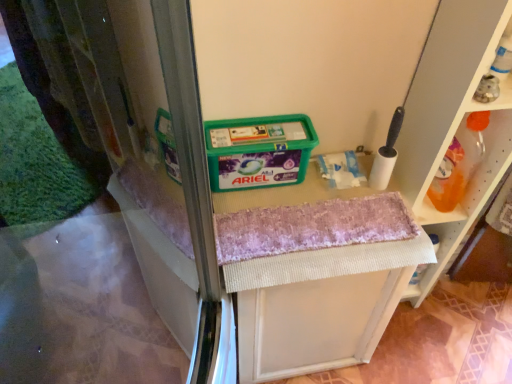
Question: Should I look upward or downward to see translucent plastic bottle at upper right, acting as the second shelf starting from the front?

Choices:
 (A) up
 (B) down

Answer: (A)

Question: Is white plastic shelf at right, arranged as the 2th shelf when viewed from the back, not within pink textured bath towel at center?

Choices:
 (A) no
 (B) yes

Answer: (B)

Question: Is white plastic shelf at right, arranged as the 2th shelf when viewed from the back, at the left side of pink textured bath towel at center?

Choices:
 (A) no
 (B) yes

Answer: (A)

Question: Is white plastic shelf at right, arranged as the 2th shelf when viewed from the back, not near pink textured bath towel at center?

Choices:
 (A) no
 (B) yes

Answer: (A)

Question: Does white plastic shelf at right, which is counted as the first shelf, starting from the front, lie behind pink textured bath towel at center?

Choices:
 (A) no
 (B) yes

Answer: (A)

Question: Does white plastic shelf at right, arranged as the 2th shelf when viewed from the back, have a lesser height compared to pink textured bath towel at center?

Choices:
 (A) yes
 (B) no

Answer: (B)

Question: Is white plastic shelf at right, which is counted as the first shelf, starting from the front, wider than pink textured bath towel at center?

Choices:
 (A) no
 (B) yes

Answer: (B)

Question: From the image's perspective, is textured fabric vanity at center located above white foam brush at upper right?

Choices:
 (A) no
 (B) yes

Answer: (A)

Question: Considering the relative sizes of textured fabric vanity at center and white foam brush at upper right in the image provided, is textured fabric vanity at center wider than white foam brush at upper right?

Choices:
 (A) yes
 (B) no

Answer: (A)

Question: Is textured fabric vanity at center to the right of white foam brush at upper right from the viewer's perspective?

Choices:
 (A) no
 (B) yes

Answer: (A)

Question: From a real-world perspective, is textured fabric vanity at center located higher than white foam brush at upper right?

Choices:
 (A) no
 (B) yes

Answer: (A)

Question: Is the position of textured fabric vanity at center more distant than that of white foam brush at upper right?

Choices:
 (A) no
 (B) yes

Answer: (B)

Question: Is textured fabric vanity at center to the left of white foam brush at upper right from the viewer's perspective?

Choices:
 (A) yes
 (B) no

Answer: (A)

Question: Can you confirm if translucent plastic bottle at upper right, the first shelf in the back-to-front sequence, is positioned to the right of white plastic shelf at right, which is counted as the first shelf, starting from the front?

Choices:
 (A) no
 (B) yes

Answer: (B)